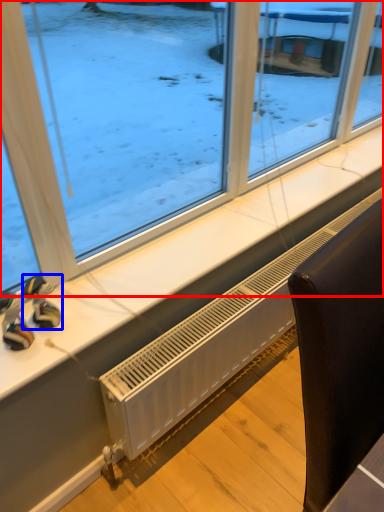
Question: Which of the following is the closest to the observer, window (highlighted by a red box) or toy (highlighted by a blue box)?

Choices:
 (A) window
 (B) toy

Answer: (A)